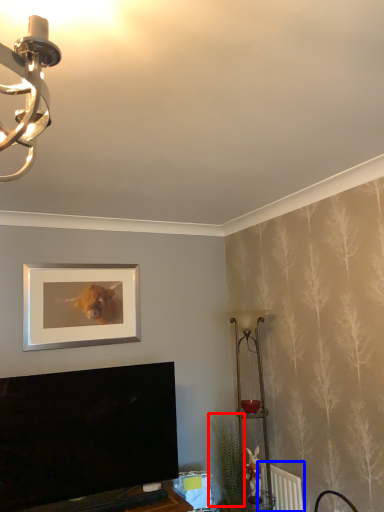
Question: Which point is closer to the camera, plant (highlighted by a red box) or radiator (highlighted by a blue box)?

Choices:
 (A) plant
 (B) radiator

Answer: (B)